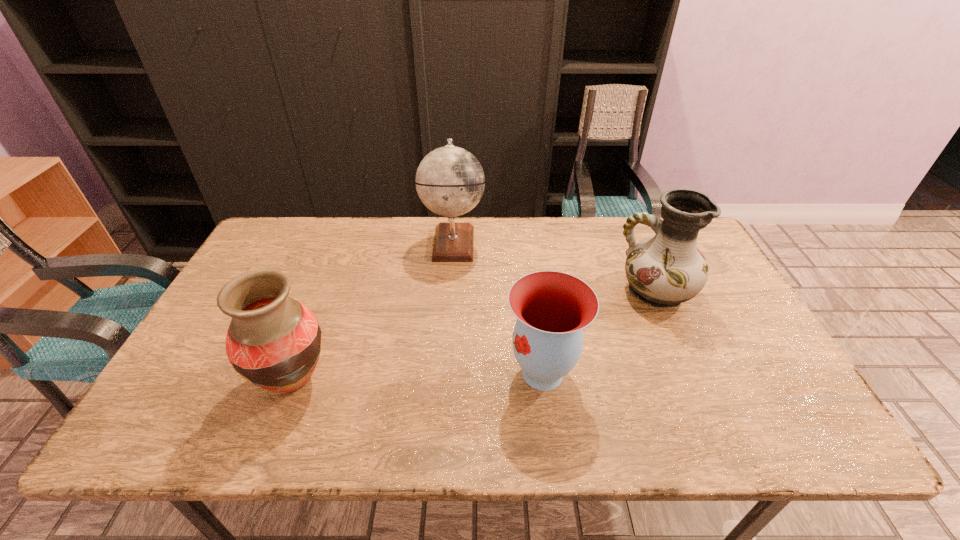
Locate an element on the screen. This screenshot has height=540, width=960. vacant region located on the right of the shortest object is located at coordinates (623, 373).

Where is `object positioned at the far edge`? The height and width of the screenshot is (540, 960). object positioned at the far edge is located at coordinates (450, 181).

The height and width of the screenshot is (540, 960). Identify the location of object present at the near edge. (273, 341).

Where is `object present at the right edge`? This screenshot has height=540, width=960. object present at the right edge is located at coordinates (665, 270).

You are a GUI agent. You are given a task and a screenshot of the screen. Output one action in this format:
    pyautogui.click(x=<x>, y=<y>)
    Task: Click on the free point at the far edge
    The width and height of the screenshot is (960, 540).
    Given the screenshot: What is the action you would take?
    pyautogui.click(x=422, y=219)

Image resolution: width=960 pixels, height=540 pixels. Identify the location of free space at the near edge of the desktop. (354, 431).

Where is `free location at the left edge`? This screenshot has height=540, width=960. free location at the left edge is located at coordinates (220, 401).

Locate an element on the screen. The image size is (960, 540). vacant space at the right edge of the desktop is located at coordinates (765, 363).

At what (x,y) coordinates should I click in order to perform the action: click on free space at the far left corner of the desktop. Please return your answer as a coordinate pair (x, y). The height and width of the screenshot is (540, 960). Looking at the image, I should click on (268, 243).

Find the location of a particular element. This screenshot has height=540, width=960. free region at the near right corner of the desktop is located at coordinates (752, 446).